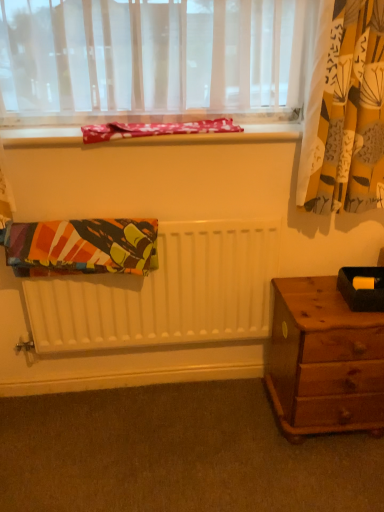
Question: Considering the relative positions of black matte box at right and red floral fabric at upper center, the 1th blanket from the top, in the image provided, is black matte box at right to the left or to the right of red floral fabric at upper center, the 1th blanket from the top,?

Choices:
 (A) left
 (B) right

Answer: (B)

Question: In the image, is black matte box at right positioned in front of or behind red floral fabric at upper center, the 1th blanket from the top?

Choices:
 (A) front
 (B) behind

Answer: (A)

Question: Based on their relative distances, which object is nearer to the white matte radiator at center?

Choices:
 (A) black matte box at right
 (B) carpet at lower center
 (C) translucent fabric at upper center
 (D) multicolored fabric at center, acting as the first blanket starting from the bottom
 (E) matte fabric at upper center

Answer: (D)

Question: Which of these objects is positioned closest to the wooden nightstand at lower right?

Choices:
 (A) translucent fabric at upper center
 (B) black matte box at right
 (C) yellow printed fabric at upper right
 (D) white matte radiator at center
 (E) multicolored fabric at center, the 2th blanket positioned from the top

Answer: (B)